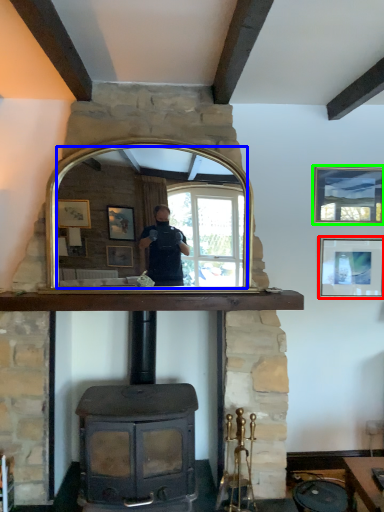
Question: Which is farther away from picture frame (highlighted by a red box)? mirror (highlighted by a blue box) or picture frame (highlighted by a green box)?

Choices:
 (A) mirror
 (B) picture frame

Answer: (A)